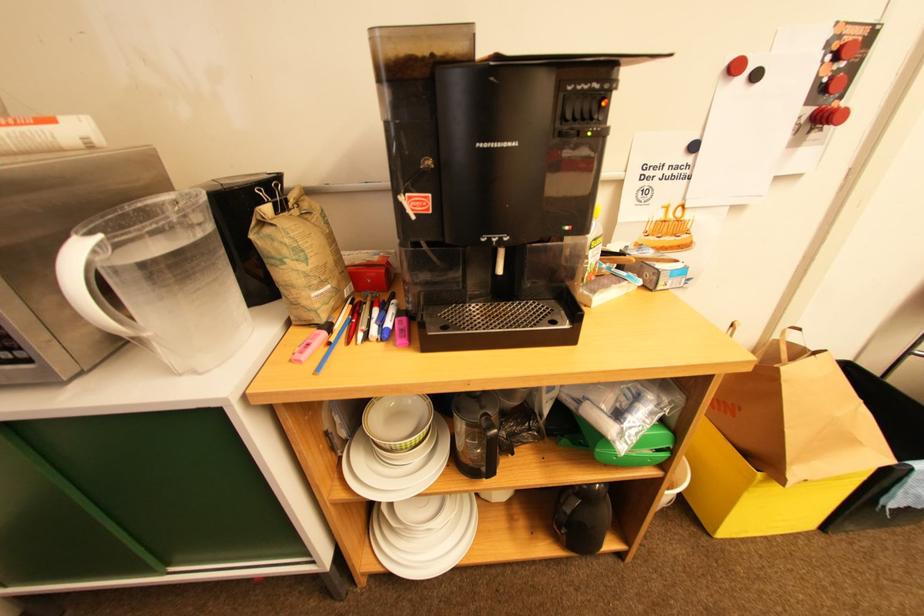
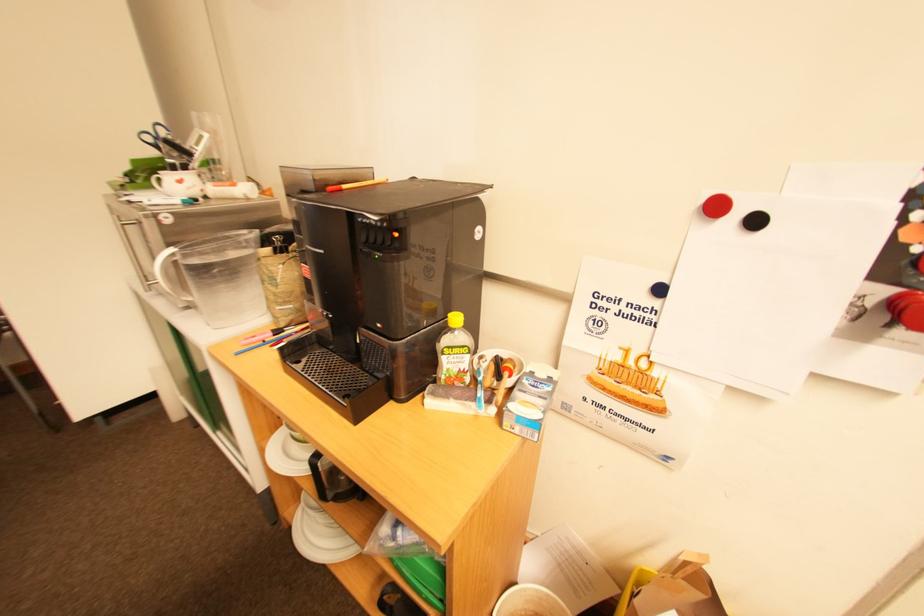
Question: The camera is either moving clockwise (left) or counter-clockwise (right) around the object. The first image is from the beginning of the video and the second image is from the end. Is the camera moving left or right when shooting the video?

Choices:
 (A) Left
 (B) Right

Answer: (B)